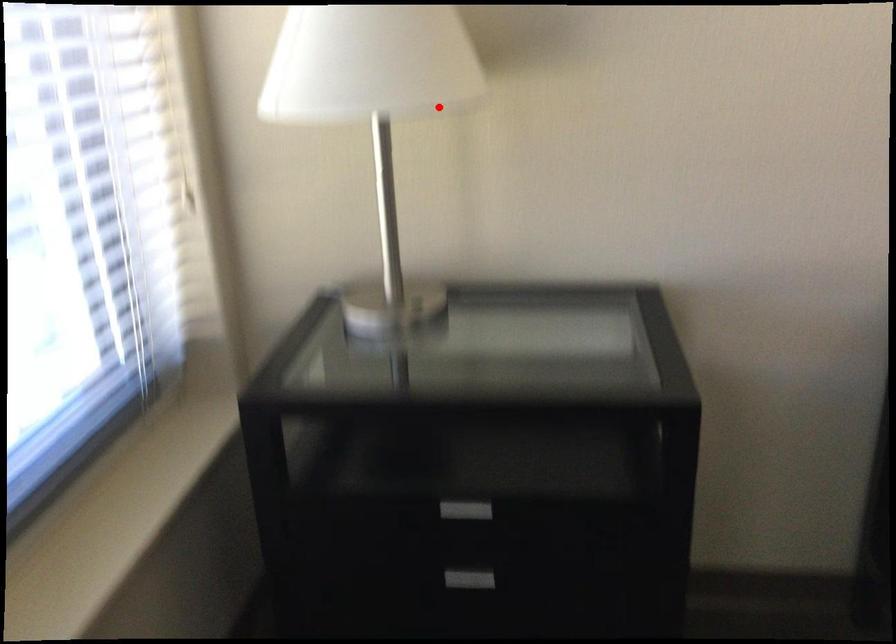
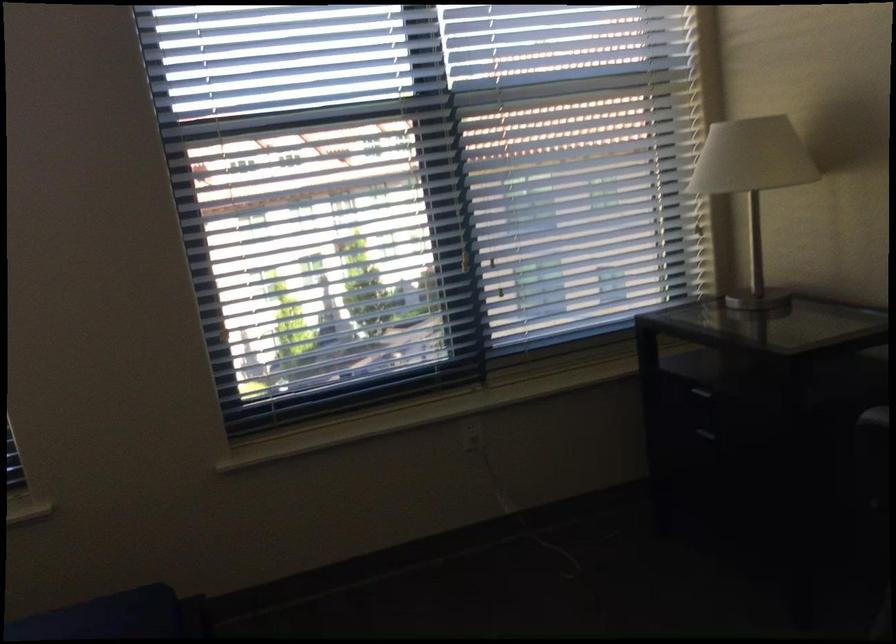
Question: I am providing you with two images of the same scene from different viewpoints. Image1 has a red point marked. In image2, the corresponding 3D location appears at what relative position? Reply with the corresponding letter.

Choices:
 (A) Closer
 (B) Farther

Answer: (B)